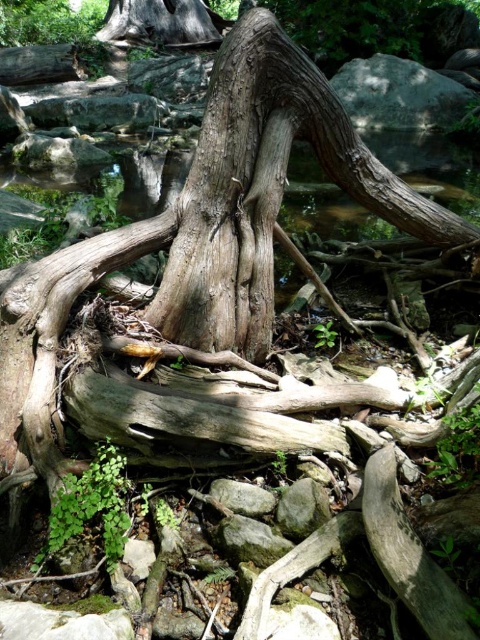
You are a hiker navigating through the area depicted in the image. You need to step over two gray rough rocks. Which one should you step over first, the gray rough rock at upper center or the gray rough rock at center?

You should step over the gray rough rock at upper center first because it is located above the gray rough rock at center, meaning it is closer to your path when moving downward.

You are standing at the origin point of the scene. Which direction should you move to reach the gray rough rock at upper center?

The gray rough rock at upper center is located at point 0.148 on the x and 0.831 on the y axis. Since you are at the origin, you should move towards the upper center direction to reach it.

You are a hiker trying to cross a rocky terrain. You see two gray rough rocks in your path. The gray rough rock at upper center and the gray rough rock at center. Which rock should you step on to ensure a more stable footing?

The gray rough rock at upper center is larger in size compared to the gray rough rock at center, so stepping on the gray rough rock at upper center would provide a more stable footing due to its larger surface area.